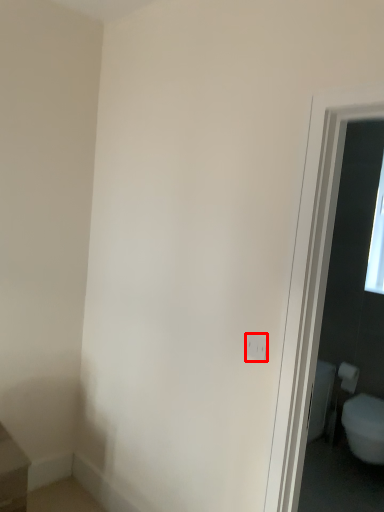
Question: From the image's perspective, considering the relative positions of electric outlet (annotated by the red box) and toilet paper in the image provided, where is electric outlet (annotated by the red box) located with respect to the staircase?

Choices:
 (A) above
 (B) below

Answer: (A)